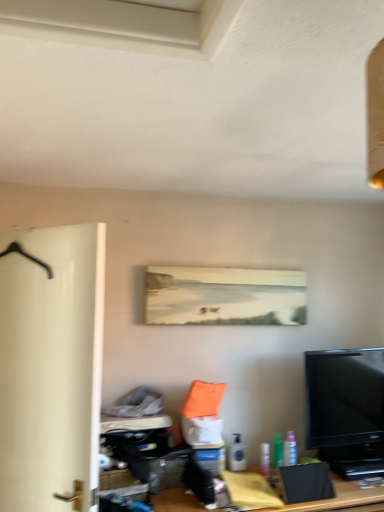
Question: Can you confirm if white matte door at left is taller than translucent plastic spray can at lower center, which appears as the first toiletry when viewed from the left?

Choices:
 (A) yes
 (B) no

Answer: (A)

Question: Is white matte door at left at the left side of translucent plastic spray can at lower center, the third toiletry when ordered from right to left?

Choices:
 (A) no
 (B) yes

Answer: (B)

Question: From the image's perspective, is white matte door at left above translucent plastic spray can at lower center, which appears as the first toiletry when viewed from the left?

Choices:
 (A) no
 (B) yes

Answer: (B)

Question: Would you say white matte door at left is outside translucent plastic spray can at lower center, which appears as the first toiletry when viewed from the left?

Choices:
 (A) yes
 (B) no

Answer: (A)

Question: Considering the relative positions of white matte door at left and translucent plastic spray can at lower center, the third toiletry when ordered from right to left, in the image provided, is white matte door at left behind translucent plastic spray can at lower center, the third toiletry when ordered from right to left,?

Choices:
 (A) yes
 (B) no

Answer: (B)

Question: Looking at the image, does pink plastic spray bottle at lower right, acting as the 3th toiletry starting from the left, seem bigger or smaller compared to wooden desk at center?

Choices:
 (A) big
 (B) small

Answer: (B)

Question: Would you say pink plastic spray bottle at lower right, positioned as the first toiletry in right-to-left order, is to the left or to the right of wooden desk at center in the picture?

Choices:
 (A) left
 (B) right

Answer: (B)

Question: Is pink plastic spray bottle at lower right, acting as the 3th toiletry starting from the left, wider or thinner than wooden desk at center?

Choices:
 (A) thin
 (B) wide

Answer: (A)

Question: From a real-world perspective, is pink plastic spray bottle at lower right, positioned as the first toiletry in right-to-left order, positioned above or below wooden desk at center?

Choices:
 (A) below
 (B) above

Answer: (B)

Question: From a real-world perspective, is translucent plastic spray can at lower center, the third toiletry when ordered from right to left, positioned above or below black glossy tv at lower right?

Choices:
 (A) above
 (B) below

Answer: (B)

Question: Which is correct: translucent plastic spray can at lower center, which appears as the first toiletry when viewed from the left, is inside black glossy tv at lower right, or outside of it?

Choices:
 (A) outside
 (B) inside

Answer: (A)

Question: Considering the positions of translucent plastic spray can at lower center, which appears as the first toiletry when viewed from the left, and black glossy tv at lower right in the image, is translucent plastic spray can at lower center, which appears as the first toiletry when viewed from the left, taller or shorter than black glossy tv at lower right?

Choices:
 (A) short
 (B) tall

Answer: (A)

Question: Considering the positions of translucent plastic spray can at lower center, the third toiletry when ordered from right to left, and black glossy tv at lower right in the image, is translucent plastic spray can at lower center, the third toiletry when ordered from right to left, bigger or smaller than black glossy tv at lower right?

Choices:
 (A) big
 (B) small

Answer: (B)

Question: Is pink plastic spray bottle at lower right, acting as the 3th toiletry starting from the left, wider or thinner than translucent plastic spray can at lower center, which appears as the first toiletry when viewed from the left?

Choices:
 (A) thin
 (B) wide

Answer: (A)

Question: In the image, is pink plastic spray bottle at lower right, acting as the 3th toiletry starting from the left, on the left side or the right side of translucent plastic spray can at lower center, which appears as the first toiletry when viewed from the left?

Choices:
 (A) right
 (B) left

Answer: (A)